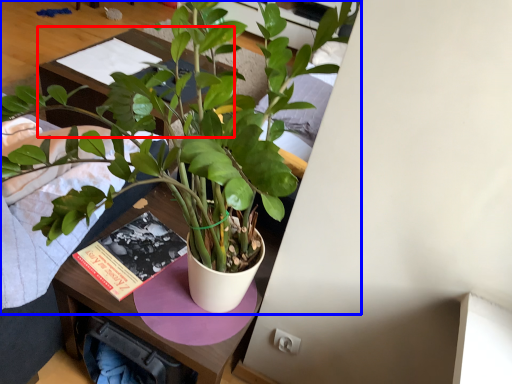
Question: Which point is closer to the camera, table (highlighted by a red box) or houseplant (highlighted by a blue box)?

Choices:
 (A) table
 (B) houseplant

Answer: (B)